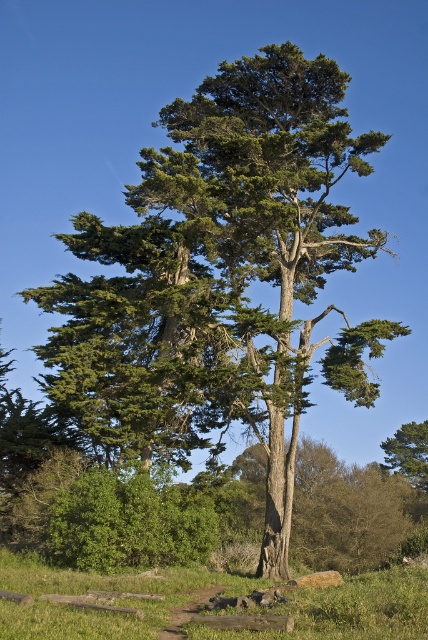
You are planning to set up a picnic area in the serene outdoor scene. You want to place a picnic blanket on the green grass at lower center and also want to lean a ladder against the green rough bark tree at lower right. Considering the sizes of these objects, will the ladder fit comfortably against the tree without overhanging the grass area?

The green grass at lower center is larger in size compared to the green rough bark tree at lower right. Since the tree is smaller than the grass area, the ladder may not have enough vertical space to lean comfortably against the tree without overhanging the grass area.

You are a gardener who wants to plant a new flower bed between the green grass at lower center and the green rough bark tree at lower right. Which area should you choose to ensure the flowers will have enough sunlight, considering their height requirements?

The green grass at lower center is taller than the green rough bark tree at lower right. Therefore, planting the flower bed near the green rough bark tree at lower right would provide more sunlight since it is shorter and less likely to block the sunlight compared to the taller grass area.